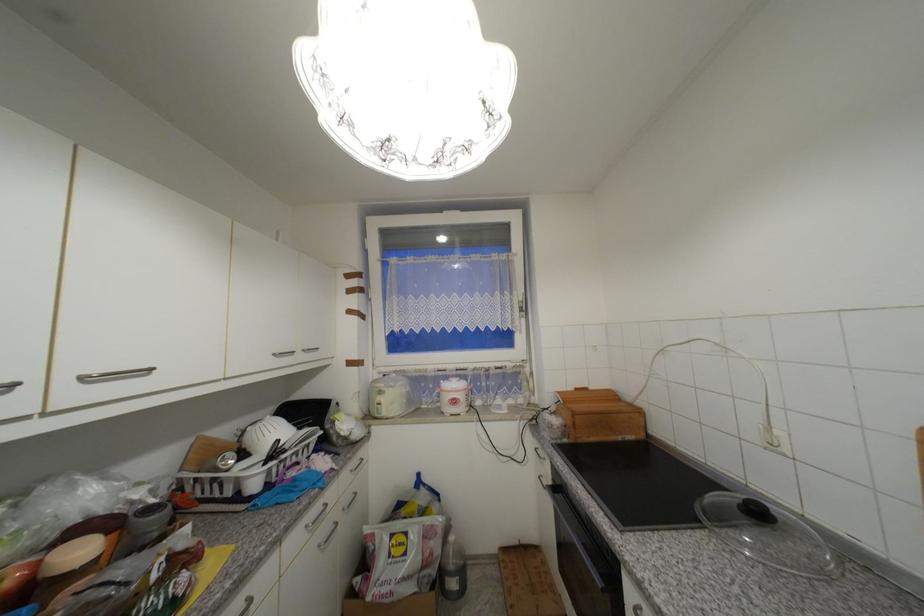
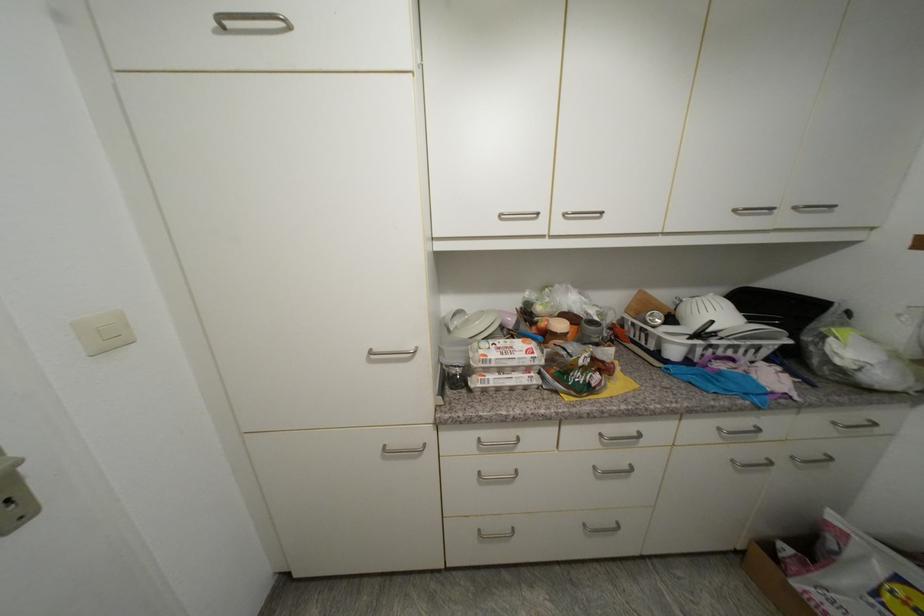
Find the pixel in the second image that matches the point at 309,352 in the first image.

(800, 209)